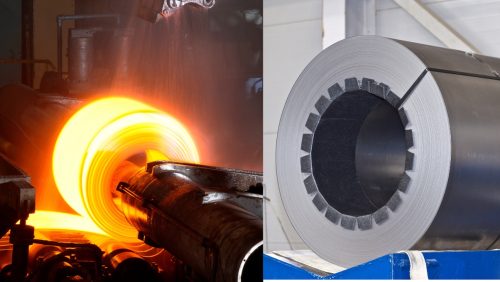
You are a GUI agent. You are given a task and a screenshot of the screen. Output one action in this format:
    pyautogui.click(x=<x>, y=<y>)
    Task: Click on the door
    Image resolution: width=500 pixels, height=282 pixels.
    Given the screenshot: What is the action you would take?
    pyautogui.click(x=12, y=36)